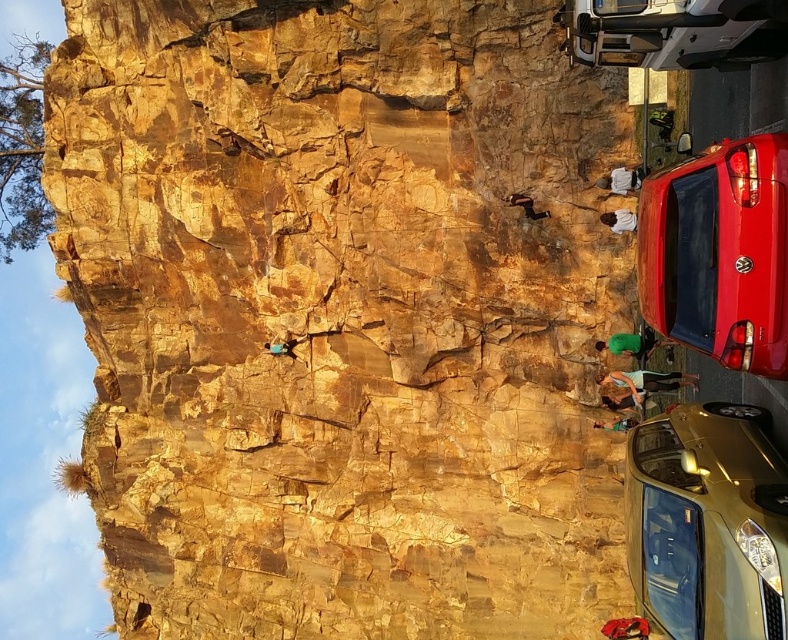
You are a hiker who wants to park your car at the rock climbing area. You see a gold metallic car at lower right and a shiny red car at right. Which car is parked closer to the base of the cliff?

The gold metallic car at lower right is positioned under the shiny red car at right, meaning it is parked closer to the base of the cliff.

You are a photographer planning to capture a wide shot of the rock climbing area. You want to ensure both the gold metallic car at lower right and the shiny red car at right are visible in the frame. Considering their sizes, which car might require you to adjust your camera angle more to include it in the shot?

The shiny red car at right might require more adjustment since it occupies more space than the gold metallic car at lower right, so it might need a wider angle or closer positioning to fit both into the frame.

You are a delivery driver who needs to park your truck between the gold metallic car at lower right and the shiny red car at right. The truck is 6 meters long. Is there enough space between them to park your truck?

The gold metallic car at lower right is 5.23 meters from the shiny red car at right. Since the truck is 6 meters long, there isn not enough space between them to park the truck.